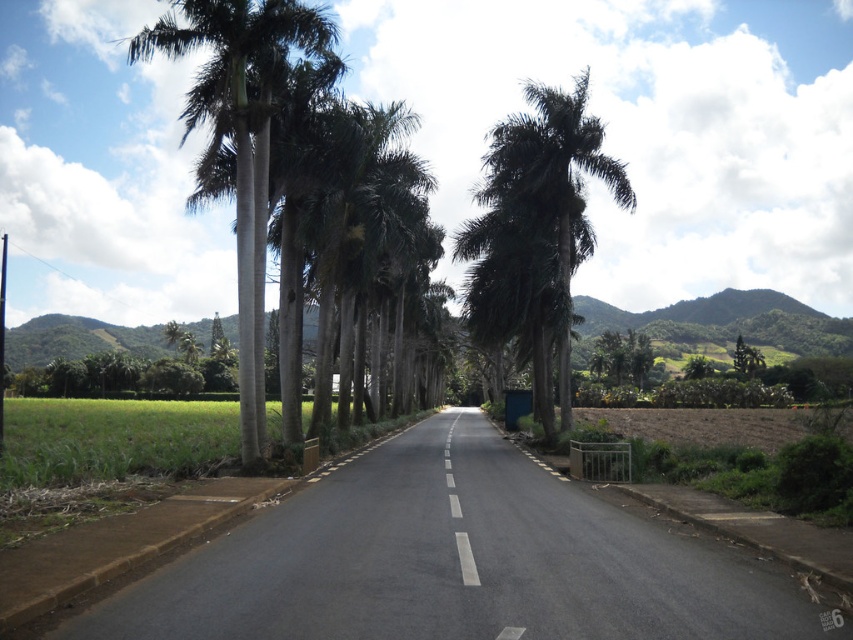
Question: Among these points, which one is nearest to the camera?

Choices:
 (A) (584, 112)
 (B) (450, 493)
 (C) (300, 20)

Answer: (B)

Question: Estimate the real-world distances between objects in this image. Which object is farther from the green leafy palm tree at center?

Choices:
 (A) white smooth palm trees at left
 (B) white smooth line at center

Answer: (B)

Question: Is green leafy palm tree at center bigger than white smooth line at center?

Choices:
 (A) yes
 (B) no

Answer: (A)

Question: Estimate the real-world distances between objects in this image. Which object is closer to the green leafy palm tree at center?

Choices:
 (A) white smooth line at center
 (B) white smooth palm trees at left

Answer: (B)

Question: Is green leafy palm tree at center positioned in front of white smooth palm trees at left?

Choices:
 (A) no
 (B) yes

Answer: (A)

Question: Can you confirm if white smooth palm trees at left is smaller than white smooth line at center?

Choices:
 (A) no
 (B) yes

Answer: (A)